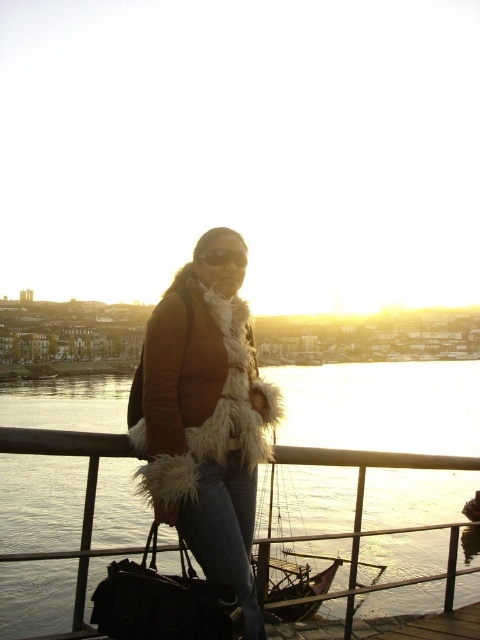
You are standing at the riverside and want to take a photo. There are two points marked on the scene, point A at coordinates point (x=262, y=497) and point B at coordinates point (x=160, y=515). Which point is closer to your camera position?

Point A at coordinates point (x=262, y=497) is further to the camera than point B at coordinates point (x=160, y=515), so point B is closer to the camera position.

Consider the image. You are standing at the center of the image and want to place a new object exactly where the black leather bag at lower left is currently located. What are the 2D coordinates you should use for placement?

The 2D coordinates for the black leather bag at lower left are at point (163, 602).